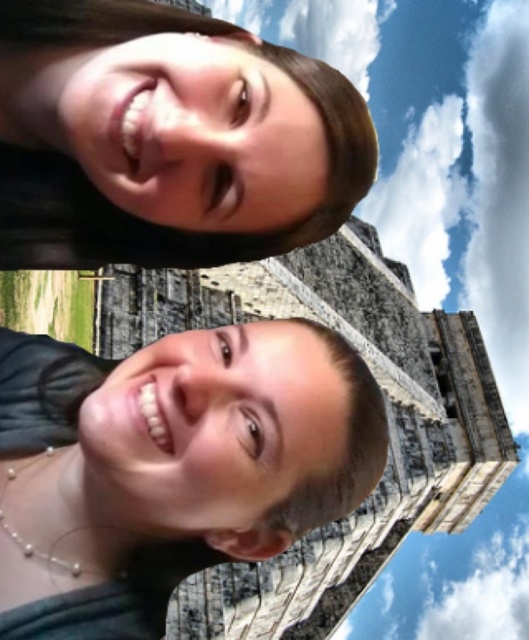
You are standing in front of the ancient Mayan temple and want to take a selfie with two friends. You notice two points marked in the scene at coordinates point (141, 566) and point (31, 168). Which of these points is closer to you?

Point (141, 566) is closer to the viewer than point (31, 168).

You are a photographer analyzing the composition of this image. The temple is at the bottom left corner of the frame. Where is the matte black hair at center located relative to the temple?

The matte black hair at center is located at point 0.730 on the x axis and 0.321 on the y axis relative to the temple.